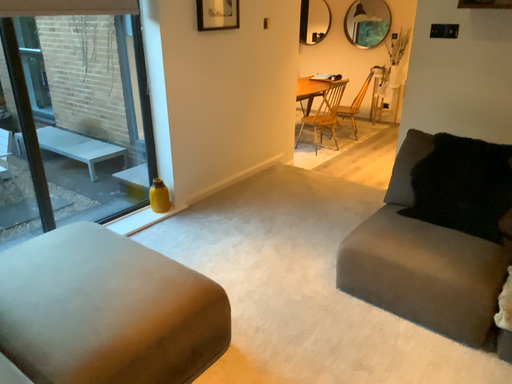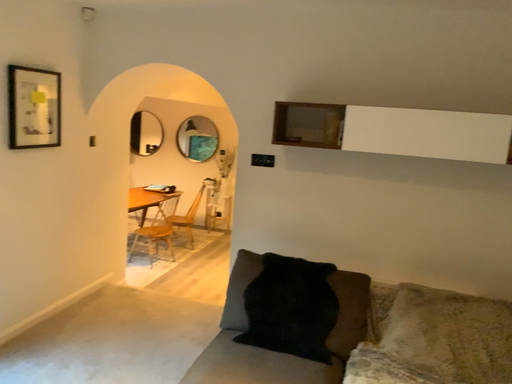
Question: Which way did the camera rotate in the video?

Choices:
 (A) rotated left
 (B) rotated right

Answer: (B)